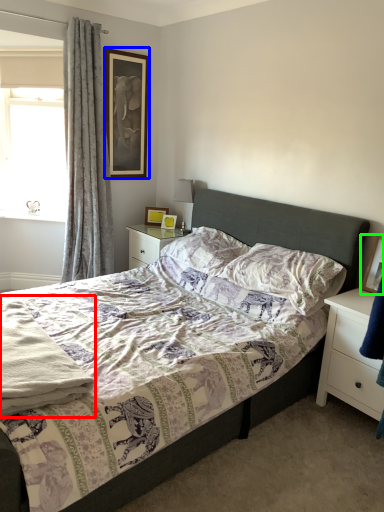
Question: Estimate the real-world distances between objects in this image. Which object is closer to material (highlighted by a red box), picture frame (highlighted by a blue box) or picture frame (highlighted by a green box)?

Choices:
 (A) picture frame
 (B) picture frame

Answer: (B)